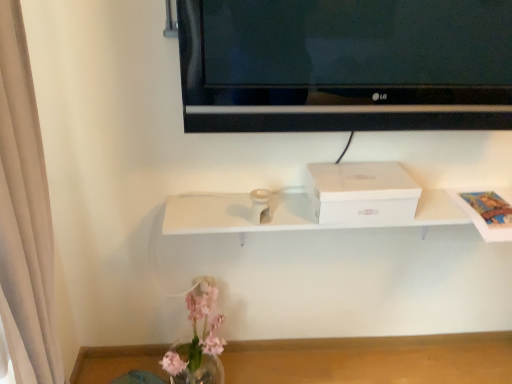
Question: Is transparent glass vase at lower center closer to the viewer compared to translucent glass vase at lower left?

Choices:
 (A) yes
 (B) no

Answer: (B)

Question: Is transparent glass vase at lower center not near translucent glass vase at lower left?

Choices:
 (A) yes
 (B) no

Answer: (B)

Question: From the image's perspective, is transparent glass vase at lower center located above translucent glass vase at lower left?

Choices:
 (A) yes
 (B) no

Answer: (B)

Question: Is transparent glass vase at lower center to the left of translucent glass vase at lower left from the viewer's perspective?

Choices:
 (A) no
 (B) yes

Answer: (A)

Question: Can you confirm if transparent glass vase at lower center is taller than translucent glass vase at lower left?

Choices:
 (A) yes
 (B) no

Answer: (B)

Question: Does transparent glass vase at lower center contain translucent glass vase at lower left?

Choices:
 (A) no
 (B) yes

Answer: (A)

Question: From the image's perspective, is black glossy tv at upper center located above transparent glass vase at lower center?

Choices:
 (A) no
 (B) yes

Answer: (B)

Question: Is black glossy tv at upper center to the right of transparent glass vase at lower center from the viewer's perspective?

Choices:
 (A) yes
 (B) no

Answer: (A)

Question: Is black glossy tv at upper center oriented towards transparent glass vase at lower center?

Choices:
 (A) no
 (B) yes

Answer: (A)

Question: Is black glossy tv at upper center closer to camera compared to transparent glass vase at lower center?

Choices:
 (A) yes
 (B) no

Answer: (A)

Question: Is black glossy tv at upper center looking in the opposite direction of transparent glass vase at lower center?

Choices:
 (A) yes
 (B) no

Answer: (B)

Question: Can you confirm if black glossy tv at upper center is bigger than transparent glass vase at lower center?

Choices:
 (A) yes
 (B) no

Answer: (B)

Question: Is white cardboard box at center thinner than transparent glass vase at lower center?

Choices:
 (A) yes
 (B) no

Answer: (A)